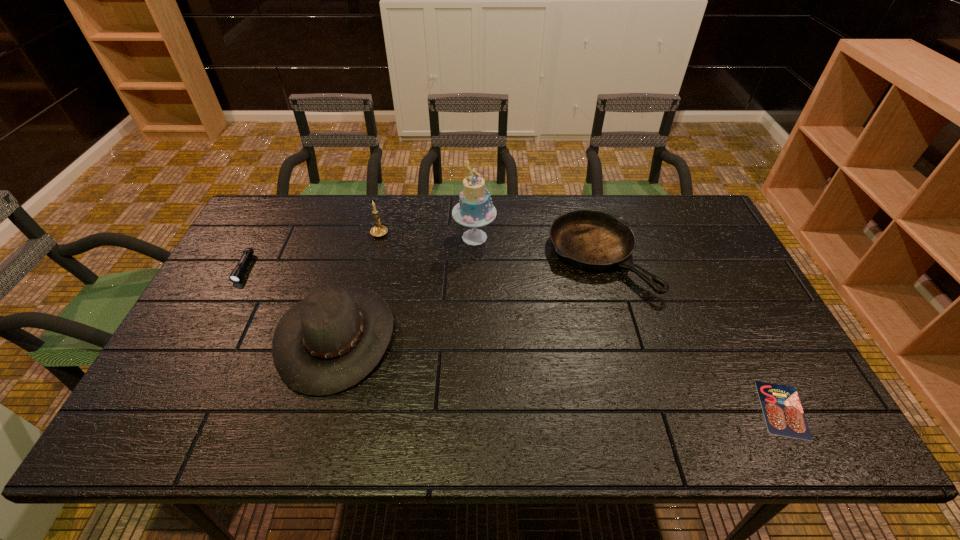
Identify the location of vacant space located 0.160m with a ladder on the side of the third object from right to left. The height and width of the screenshot is (540, 960). (544, 237).

This screenshot has width=960, height=540. In order to click on vacant region located on the handle side of the candle holder in this screenshot , I will do `click(384, 214)`.

Image resolution: width=960 pixels, height=540 pixels. Find the location of `vacant position located on the front-facing side of the hat`. vacant position located on the front-facing side of the hat is located at coordinates (516, 336).

The height and width of the screenshot is (540, 960). What are the coordinates of `free space located on the front of the frying pan` in the screenshot? It's located at (630, 370).

Find the location of `free space located 0.250m at the lens end of the flashlight`. free space located 0.250m at the lens end of the flashlight is located at coordinates (199, 354).

You are a GUI agent. You are given a task and a screenshot of the screen. Output one action in this format:
    pyautogui.click(x=<x>, y=<y>)
    Task: Click on the vacant space located on the back of the rightmost object
    Image resolution: width=960 pixels, height=540 pixels.
    Given the screenshot: What is the action you would take?
    pyautogui.click(x=743, y=332)

Locate an element on the screen. The height and width of the screenshot is (540, 960). cake present at the far edge is located at coordinates (475, 209).

Identify the location of candle holder present at the far edge. (379, 230).

Where is `frying pan present at the far edge`? The image size is (960, 540). frying pan present at the far edge is located at coordinates (592, 240).

Identify the location of object that is at the near edge. The image size is (960, 540). (784, 416).